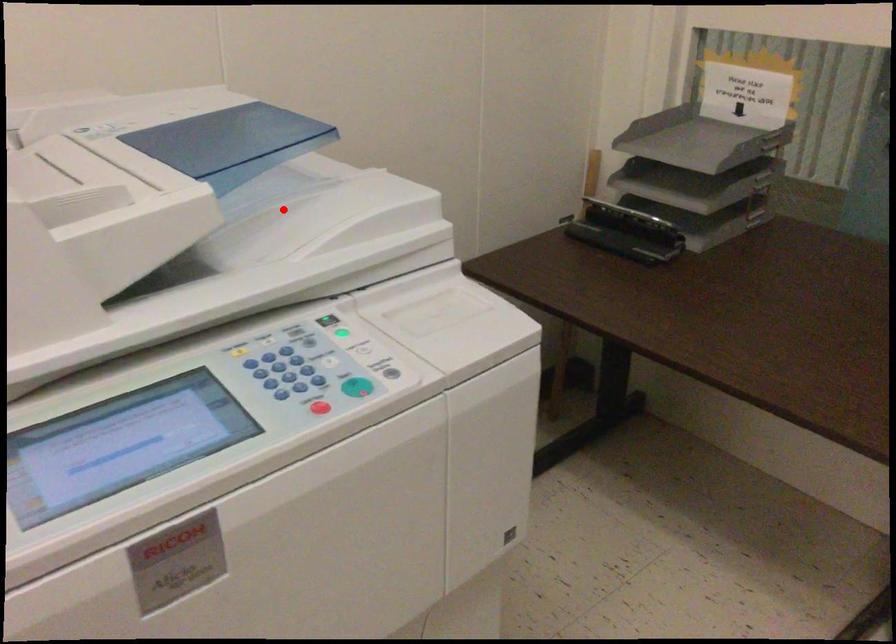
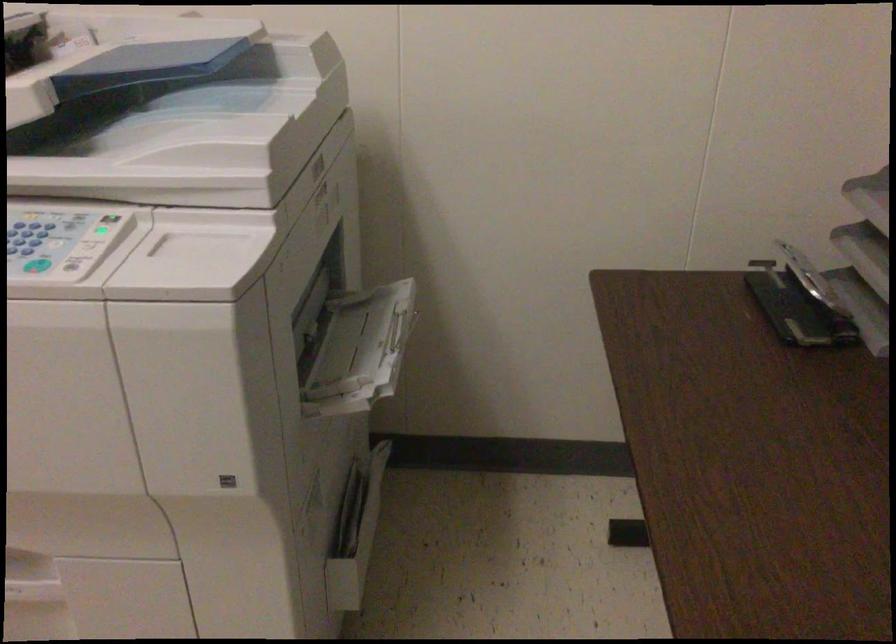
Question: I am providing you with two images of the same scene from different viewpoints. A red point is shown in image1. For the corresponding object point in image2, is it positioned nearer or farther from the camera?

Choices:
 (A) Nearer
 (B) Farther

Answer: (B)